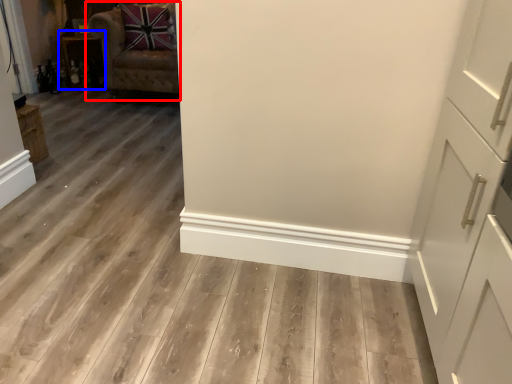
Question: Which of the following is the closest to the observer, chair (highlighted by a red box) or cabinetry (highlighted by a blue box)?

Choices:
 (A) chair
 (B) cabinetry

Answer: (A)